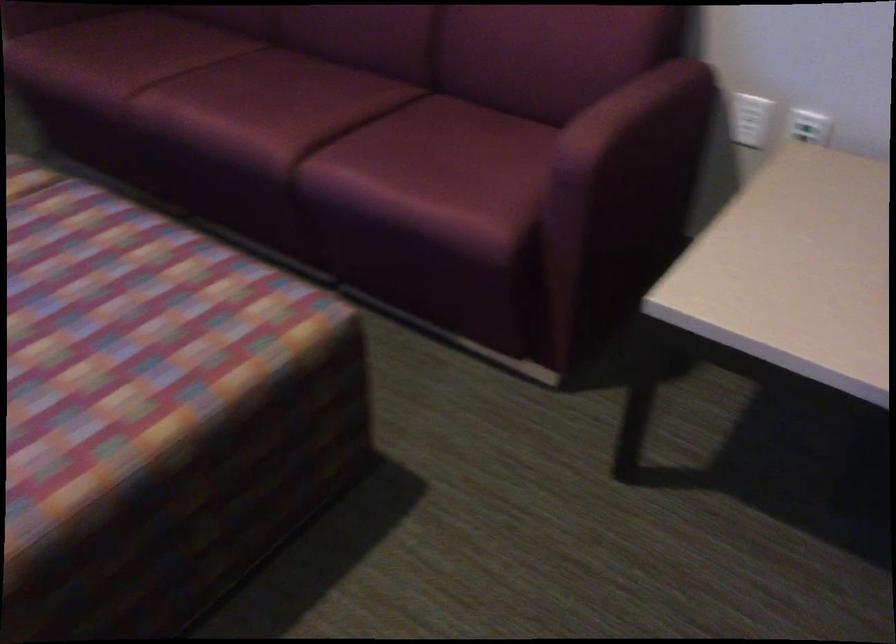
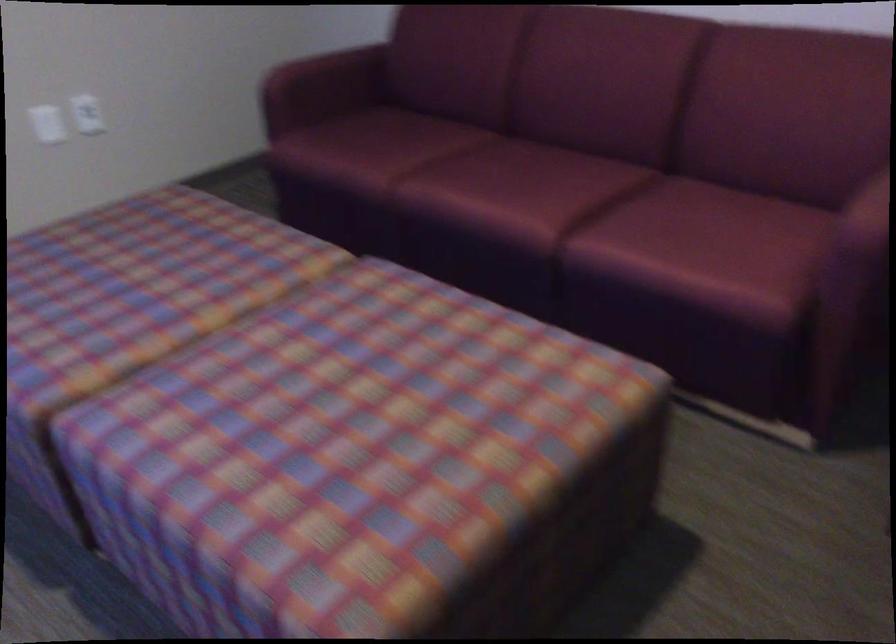
What movement of the cameraman would produce the second image?

The cameraman walked toward left, backward.